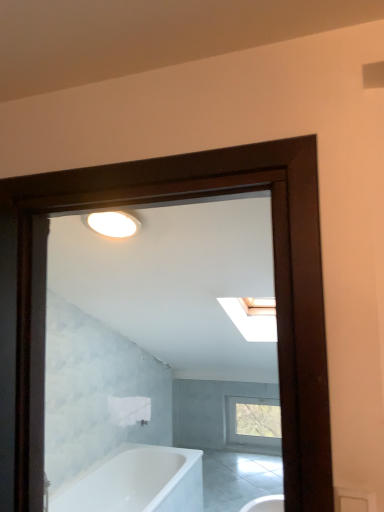
Question: Would you consider white glossy bathtub at lower left to be distant from clear glass window at center?

Choices:
 (A) no
 (B) yes

Answer: (B)

Question: Does white glossy bathtub at lower left lie behind clear glass window at center?

Choices:
 (A) no
 (B) yes

Answer: (A)

Question: Can you confirm if white glossy bathtub at lower left is positioned to the right of clear glass window at center?

Choices:
 (A) no
 (B) yes

Answer: (A)

Question: Could clear glass window at center be considered to be inside white glossy bathtub at lower left?

Choices:
 (A) no
 (B) yes

Answer: (A)

Question: From a real-world perspective, is white glossy bathtub at lower left positioned under clear glass window at center based on gravity?

Choices:
 (A) no
 (B) yes

Answer: (B)

Question: From the image's perspective, is white glossy bathtub at lower left over clear glass window at center?

Choices:
 (A) yes
 (B) no

Answer: (A)

Question: From a real-world perspective, is clear glass window at center located higher than white glossy bathtub at lower left?

Choices:
 (A) no
 (B) yes

Answer: (B)

Question: Is clear glass window at center facing away from white glossy bathtub at lower left?

Choices:
 (A) no
 (B) yes

Answer: (A)

Question: Does clear glass window at center lie in front of white glossy bathtub at lower left?

Choices:
 (A) yes
 (B) no

Answer: (B)

Question: Is clear glass window at center to the left of white glossy bathtub at lower left from the viewer's perspective?

Choices:
 (A) no
 (B) yes

Answer: (A)

Question: Is white glossy bathtub at lower left completely or partially inside clear glass window at center?

Choices:
 (A) no
 (B) yes

Answer: (A)

Question: Are clear glass window at center and white glossy bathtub at lower left located far from each other?

Choices:
 (A) yes
 (B) no

Answer: (A)

Question: Is white glossy bathtub at lower left taller or shorter than clear glass window at center?

Choices:
 (A) short
 (B) tall

Answer: (B)